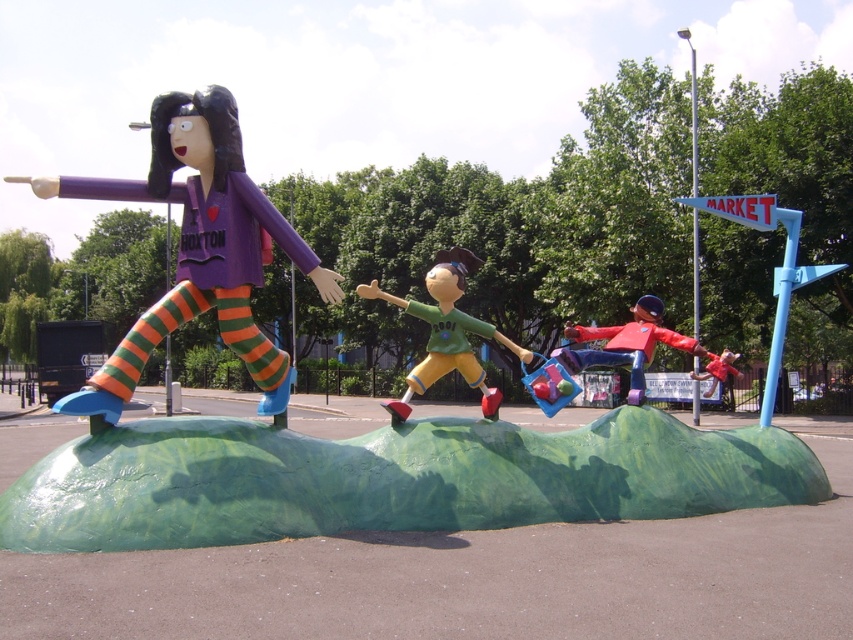
Question: Can you confirm if matte purple figure at left is positioned below matte green plastic toy at center?

Choices:
 (A) no
 (B) yes

Answer: (B)

Question: Is matte green plastic toy at center positioned behind red fabric scarecrow at lower right?

Choices:
 (A) no
 (B) yes

Answer: (A)

Question: Among these points, which one is farthest from the camera?

Choices:
 (A) (242, 172)
 (B) (630, 332)
 (C) (453, 296)

Answer: (B)

Question: Considering the real-world distances, which object is farthest from the matte green plastic toy at center?

Choices:
 (A) matte purple figure at left
 (B) red fabric scarecrow at lower right

Answer: (A)

Question: Is matte purple figure at left further to camera compared to matte green plastic toy at center?

Choices:
 (A) yes
 (B) no

Answer: (B)

Question: Which point is closer to the camera?

Choices:
 (A) (416, 388)
 (B) (218, 259)

Answer: (B)